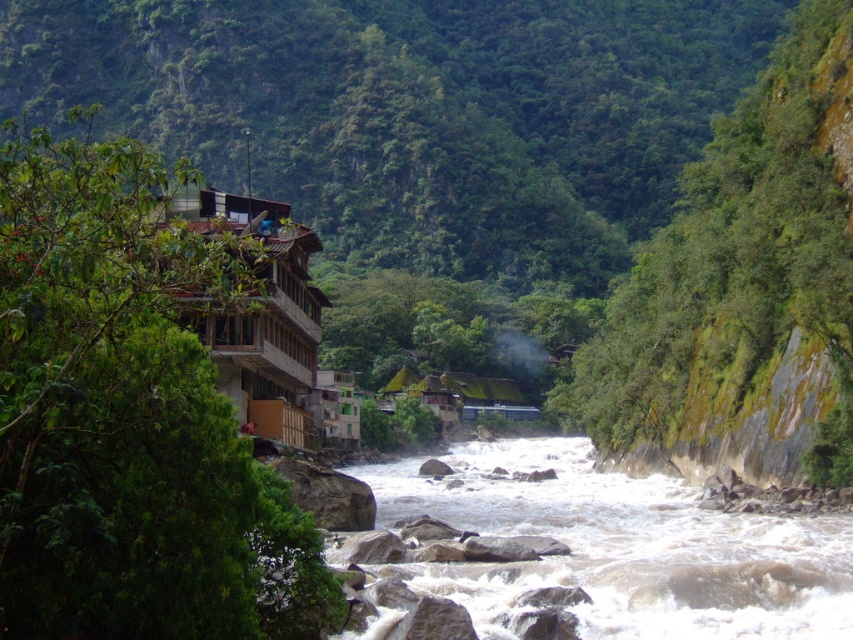
Question: Is white frothy water at center to the right of wooden balcony at left from the viewer's perspective?

Choices:
 (A) yes
 (B) no

Answer: (A)

Question: Which object is farther from the camera taking this photo?

Choices:
 (A) white frothy water at center
 (B) wooden balcony at left

Answer: (A)

Question: Is white frothy water at center smaller than wooden balcony at left?

Choices:
 (A) yes
 (B) no

Answer: (A)

Question: Does white frothy water at center have a larger size compared to wooden balcony at left?

Choices:
 (A) no
 (B) yes

Answer: (A)

Question: Which object is closer to the camera taking this photo?

Choices:
 (A) white frothy water at center
 (B) wooden balcony at left

Answer: (B)